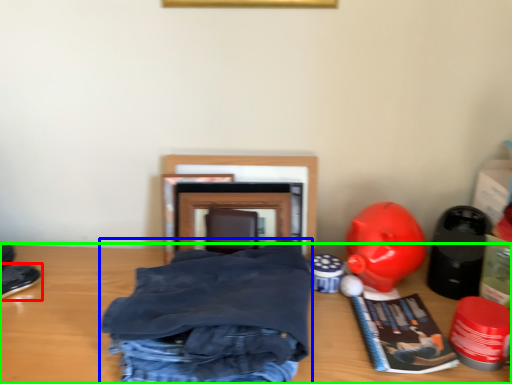
Question: Considering the real-world distances, which object is farthest from footwear (highlighted by a red box)? clothing (highlighted by a blue box) or table (highlighted by a green box)?

Choices:
 (A) clothing
 (B) table

Answer: (A)